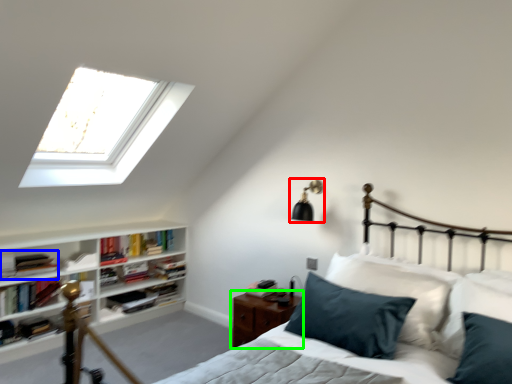
Question: Estimate the real-world distances between objects in this image. Which object is farther from light fixture (highlighted by a red box), book (highlighted by a blue box) or nightstand (highlighted by a green box)?

Choices:
 (A) book
 (B) nightstand

Answer: (A)